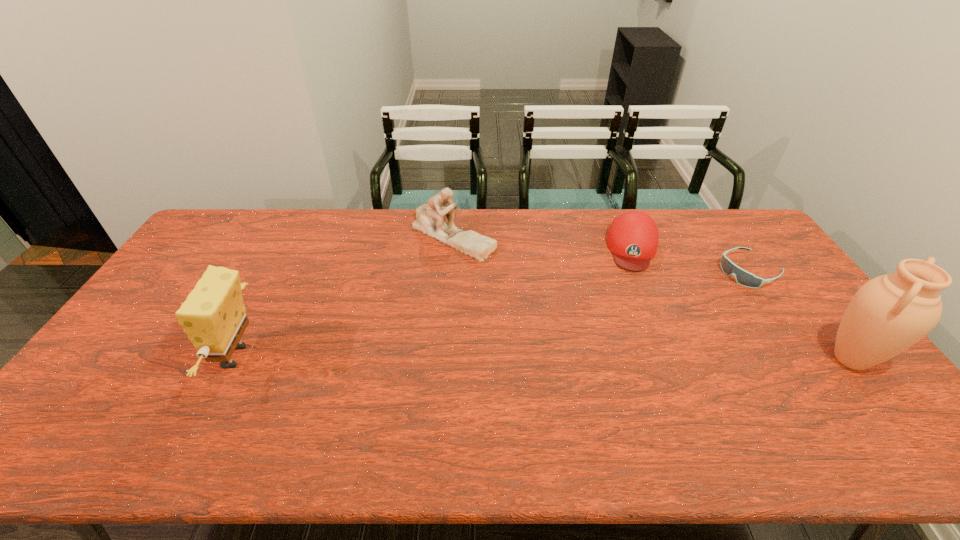
The height and width of the screenshot is (540, 960). In order to click on the leftmost object in this screenshot , I will do (213, 316).

Where is `the second tallest object`? This screenshot has height=540, width=960. the second tallest object is located at coordinates (213, 316).

The width and height of the screenshot is (960, 540). I want to click on urn, so click(888, 314).

You are a GUI agent. You are given a task and a screenshot of the screen. Output one action in this format:
    pyautogui.click(x=<x>, y=<y>)
    Task: Click on the third tallest object
    The width and height of the screenshot is (960, 540).
    Given the screenshot: What is the action you would take?
    pyautogui.click(x=430, y=220)

The height and width of the screenshot is (540, 960). I want to click on the fourth object from right to left, so click(x=430, y=220).

This screenshot has height=540, width=960. I want to click on the second shortest object, so click(x=632, y=238).

Locate an element on the screen. the third object from right to left is located at coordinates tap(632, 238).

Identify the location of the shortest object. (744, 278).

Identify the location of vacant space located on the face of the leftmost object. The width and height of the screenshot is (960, 540). (134, 356).

This screenshot has height=540, width=960. I want to click on blank area located 0.130m on the face of the leftmost object, so click(164, 356).